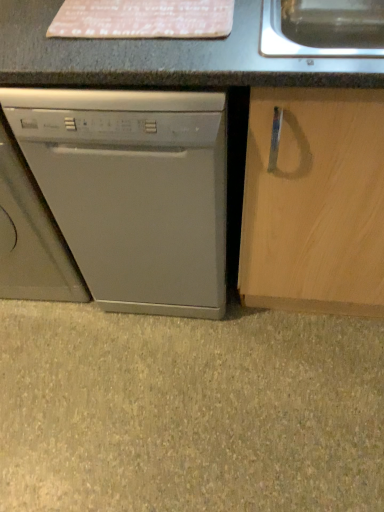
Question: Does satin silver dishwasher at left contain gray matte dishwasher at lower left?

Choices:
 (A) no
 (B) yes

Answer: (A)

Question: Considering the relative sizes of satin silver dishwasher at left and gray matte dishwasher at lower left in the image provided, is satin silver dishwasher at left shorter than gray matte dishwasher at lower left?

Choices:
 (A) yes
 (B) no

Answer: (B)

Question: Is satin silver dishwasher at left further to the viewer compared to gray matte dishwasher at lower left?

Choices:
 (A) no
 (B) yes

Answer: (A)

Question: Does satin silver dishwasher at left appear on the right side of gray matte dishwasher at lower left?

Choices:
 (A) no
 (B) yes

Answer: (A)

Question: Does satin silver dishwasher at left lie in front of gray matte dishwasher at lower left?

Choices:
 (A) no
 (B) yes

Answer: (B)

Question: From the image's perspective, does satin silver dishwasher at left appear lower than gray matte dishwasher at lower left?

Choices:
 (A) yes
 (B) no

Answer: (B)

Question: Is gray matte dishwasher at lower left taller than satin silver dishwasher at left?

Choices:
 (A) no
 (B) yes

Answer: (A)

Question: From a real-world perspective, does gray matte dishwasher at lower left stand above satin silver dishwasher at left?

Choices:
 (A) no
 (B) yes

Answer: (A)

Question: Is gray matte dishwasher at lower left bigger than satin silver dishwasher at left?

Choices:
 (A) no
 (B) yes

Answer: (A)

Question: Is gray matte dishwasher at lower left far from satin silver dishwasher at left?

Choices:
 (A) yes
 (B) no

Answer: (B)

Question: From the image's perspective, is gray matte dishwasher at lower left under satin silver dishwasher at left?

Choices:
 (A) yes
 (B) no

Answer: (A)

Question: Does gray matte dishwasher at lower left come behind satin silver dishwasher at left?

Choices:
 (A) yes
 (B) no

Answer: (A)

Question: Is point (369, 478) closer or farther from the camera than point (36, 138)?

Choices:
 (A) closer
 (B) farther

Answer: (B)